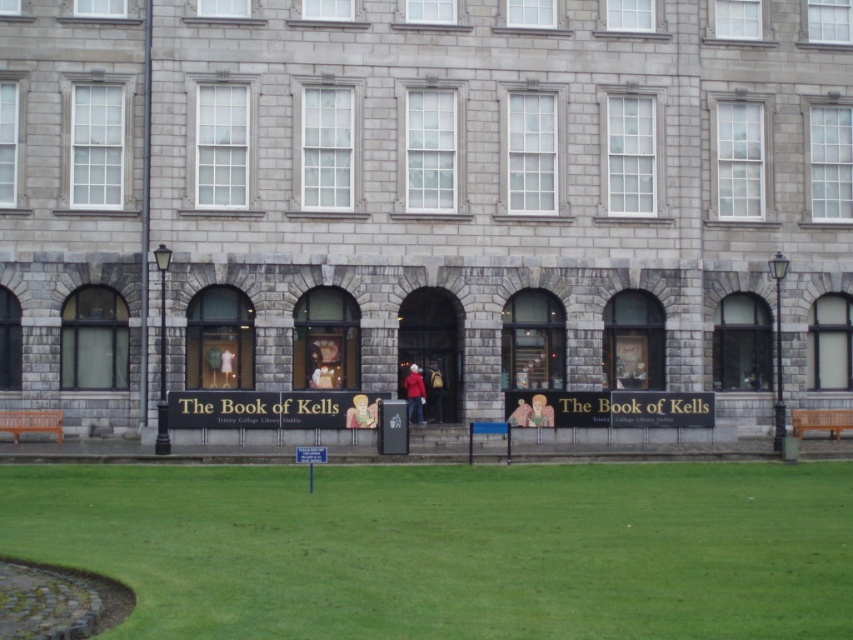
Where is `wooden bench at lower left`? The height and width of the screenshot is (640, 853). wooden bench at lower left is located at coordinates click(32, 422).

Is wooden bench at lower left below smooth beige figure at center?

Yes, wooden bench at lower left is below smooth beige figure at center.

This screenshot has height=640, width=853. Find the location of `wooden bench at lower left`. wooden bench at lower left is located at coordinates (32, 422).

The height and width of the screenshot is (640, 853). In order to click on wooden bench at lower left in this screenshot , I will do `click(32, 422)`.

Does wooden bench at lower left lie in front of matte red jacket at center?

That is True.

Between wooden bench at lower left and matte red jacket at center, which one appears on the right side from the viewer's perspective?

matte red jacket at center

At what (x,y) coordinates should I click in order to perform the action: click on wooden bench at lower left. Please return your answer as a coordinate pair (x, y). The height and width of the screenshot is (640, 853). Looking at the image, I should click on (32, 422).

Between green grass at lower center and red matte coat at center, which one is positioned higher?

Positioned higher is red matte coat at center.

Can you confirm if green grass at lower center is bigger than red matte coat at center?

Correct, green grass at lower center is larger in size than red matte coat at center.

Who is more forward, (138, 522) or (415, 380)?

Point (138, 522) is in front.

Identify the location of green grass at lower center. (451, 548).